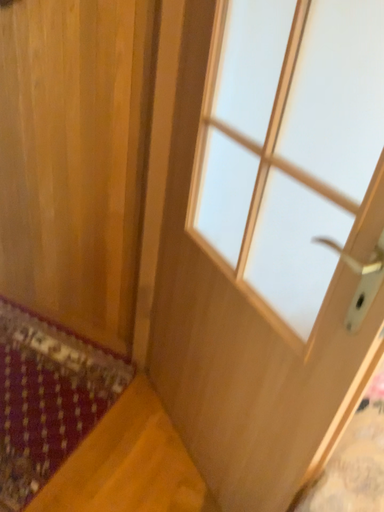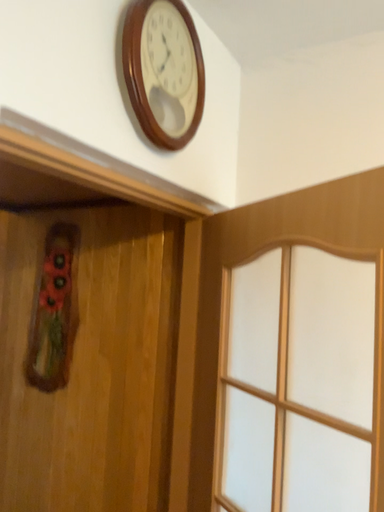
Question: How did the camera likely rotate when shooting the video?

Choices:
 (A) rotated upward
 (B) rotated downward

Answer: (A)